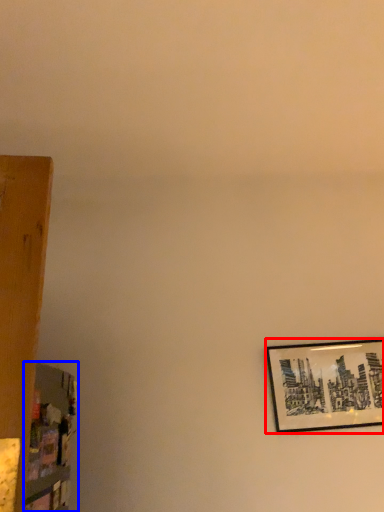
Question: Among these objects, which one is nearest to the camera, picture frame (highlighted by a red box) or shelf (highlighted by a blue box)?

Choices:
 (A) picture frame
 (B) shelf

Answer: (B)